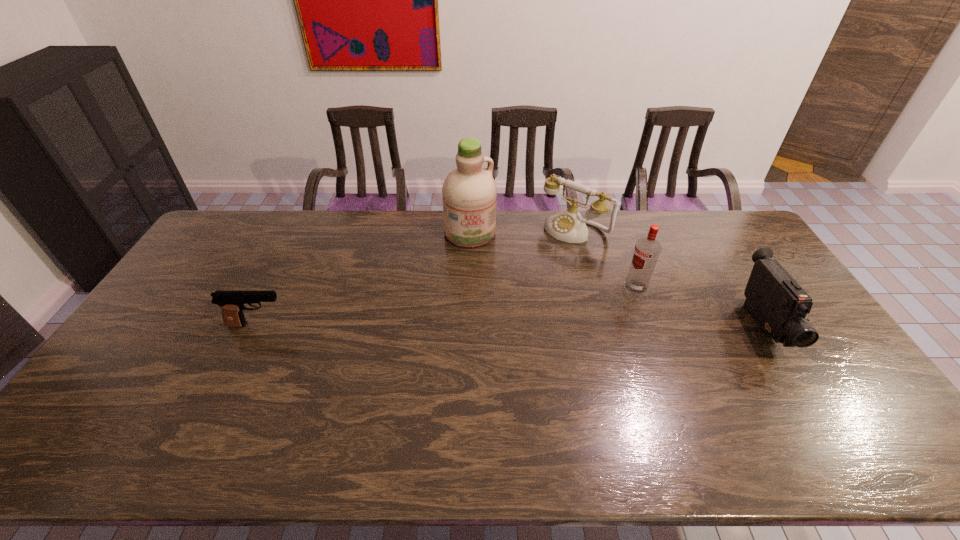
I want to click on free spot on the desktop that is between the shortest object and the camcorder and is positioned on the front label of the second object from left to right, so click(x=505, y=325).

This screenshot has height=540, width=960. What are the coordinates of `free space on the desktop that is between the leftmost object and the rightmost object and is positioned on the dial of the telephone` in the screenshot? It's located at (477, 325).

The width and height of the screenshot is (960, 540). Identify the location of free space on the desktop that is between the pistol and the rightmost object and is positioned on the front label of the vodka. (573, 326).